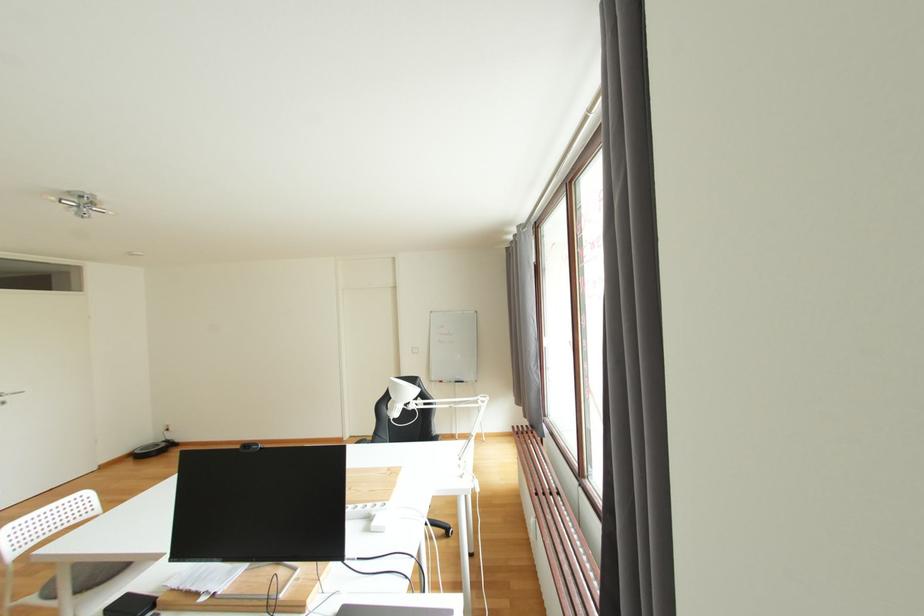
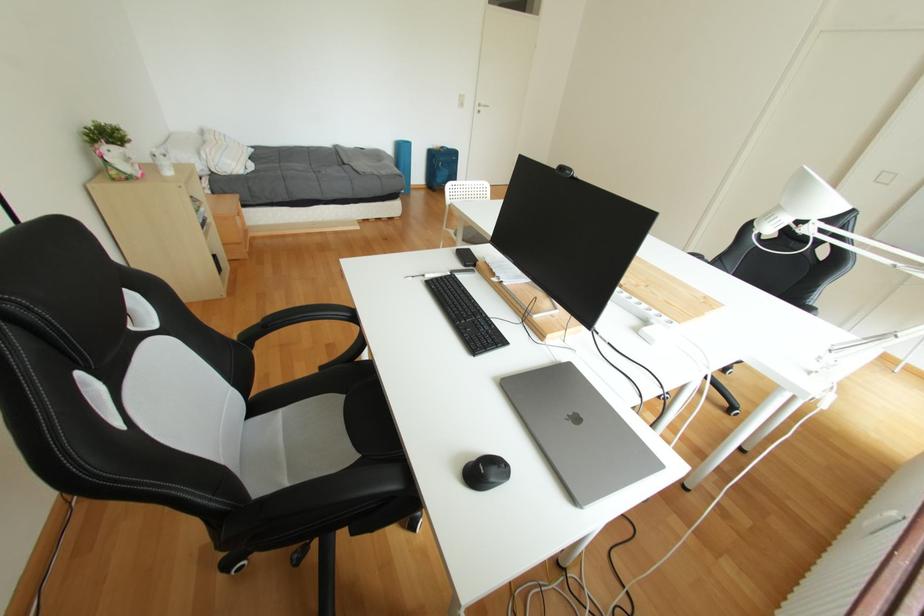
Based on the photo, first-person continuous shooting, in which direction is the camera rotating?

The rotation direction of the camera is left-down.